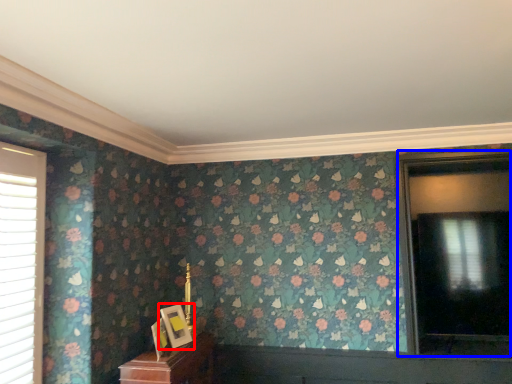
Question: Among these objects, which one is nearest to the camera, picture frame (highlighted by a red box) or window (highlighted by a blue box)?

Choices:
 (A) picture frame
 (B) window

Answer: (A)